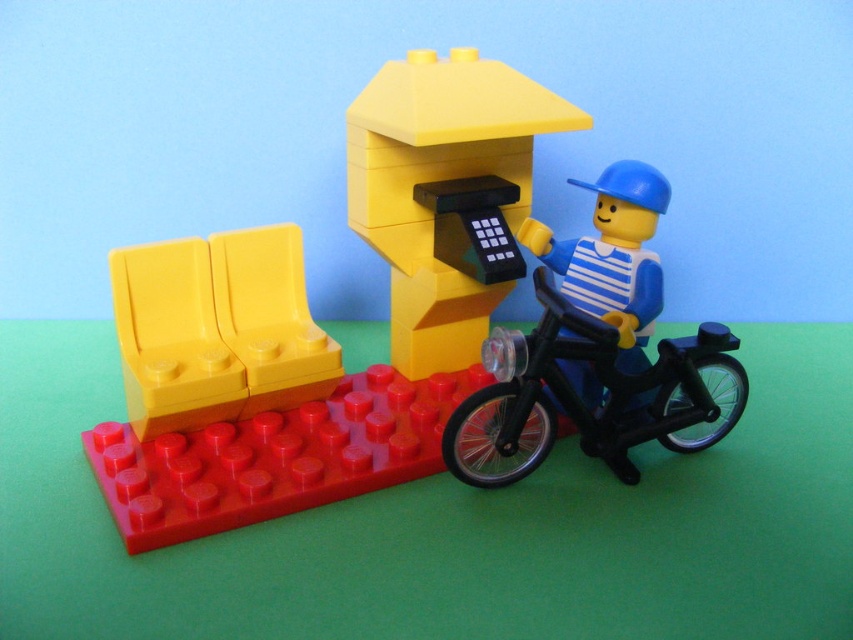
Can you confirm if matte black telephone booth at center is thinner than yellow matte bench at left?

No.

Can you confirm if matte black telephone booth at center is positioned below yellow matte bench at left?

No.

This screenshot has width=853, height=640. Find the location of `matte black telephone booth at center`. matte black telephone booth at center is located at coordinates (445, 193).

Identify the location of matte black telephone booth at center. This screenshot has width=853, height=640. (445, 193).

Is point (451, 288) farther from viewer compared to point (619, 227)?

Yes, it is behind point (619, 227).

Based on the photo, can you confirm if matte black telephone booth at center is smaller than blue matte construction worker at right?

Actually, matte black telephone booth at center might be larger than blue matte construction worker at right.

Between point (486, 60) and point (548, 268), which one is positioned in front?

Point (486, 60) is in front.

I want to click on matte black telephone booth at center, so click(445, 193).

Does point (636, 280) lie in front of point (637, 371)?

Yes.

Is smooth plastic phone booth at center taller than blue matte construction worker at right?

Correct, smooth plastic phone booth at center is much taller as blue matte construction worker at right.

Is point (260, 445) positioned in front of point (634, 166)?

Yes, point (260, 445) is in front of point (634, 166).

Image resolution: width=853 pixels, height=640 pixels. I want to click on smooth plastic phone booth at center, so click(402, 326).